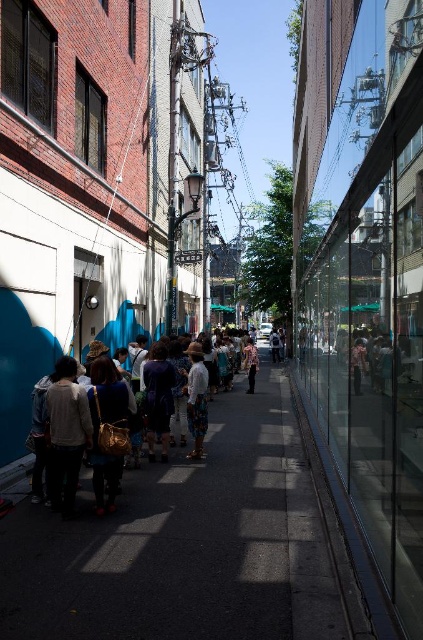
Is light beige fabric bag at center smaller than dark gray sweater at center?

Correct, light beige fabric bag at center occupies less space than dark gray sweater at center.

Is light beige fabric bag at center bigger than dark gray sweater at center?

No, light beige fabric bag at center is not bigger than dark gray sweater at center.

At what (x,y) coordinates should I click in order to perform the action: click on light beige fabric bag at center. Please return your answer as a coordinate pair (x, y). The width and height of the screenshot is (423, 640). Looking at the image, I should click on (148, 403).

Can you confirm if metallic wire at upper left is bigger than matte gold bag at center?

Yes, metallic wire at upper left is bigger than matte gold bag at center.

Can you confirm if metallic wire at upper left is wider than matte gold bag at center?

Yes.

I want to click on metallic wire at upper left, so click(112, 189).

This screenshot has width=423, height=640. In order to click on metallic wire at upper left in this screenshot , I will do `click(112, 189)`.

Who is positioned more to the left, dark gray sweater at center or white cotton shirt at center?

dark gray sweater at center

Is dark gray sweater at center thinner than white cotton shirt at center?

Indeed, dark gray sweater at center has a lesser width compared to white cotton shirt at center.

Is point (85, 390) more distant than point (252, 340)?

No, (85, 390) is closer to viewer.

The image size is (423, 640). Identify the location of dark gray sweater at center. (66, 433).